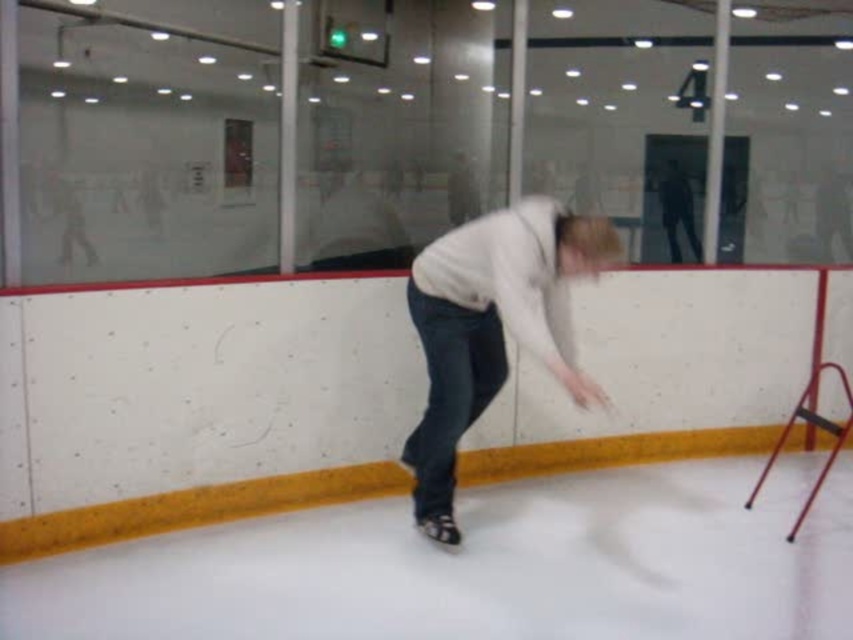
You are a photographer trying to capture the entire scene of the white smooth ice at lower center and the white matte sweater at center. Given that your camera can only focus on objects within a 100 cm width, will you be able to fit both objects in the frame without cropping?

The white smooth ice at lower center is wider than the white matte sweater at center. Since the camera can focus on objects within 100 cm width, and the ice is wider, it depends on the total combined width of both objects. However, the description only provides a comparison between their widths, not their exact measurements. Without knowing the exact width of the ice or sweater, it is impossible to determine if both will fit within the 100 cm frame.

You are a visitor at the ice rink and want to know where the white smooth ice at lower center is in relation to the white matte sweater at center. Can you tell me if the ice is above or below the sweater?

The white smooth ice at lower center is below the white matte sweater at center.

You are a spectator standing behind the glass barrier watching the skater. You notice the white smooth ice at lower center and the white matte sweater at center. Which object is positioned to the right side of the other?

The white smooth ice at lower center is to the right of the white matte sweater at center.